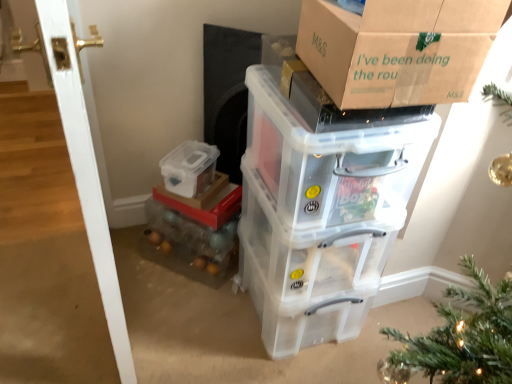
The width and height of the screenshot is (512, 384). In order to click on free space above translucent plastic storage box at lower center, the second storage box ordered from the bottom (from a real-world perspective) in this screenshot , I will do `click(202, 194)`.